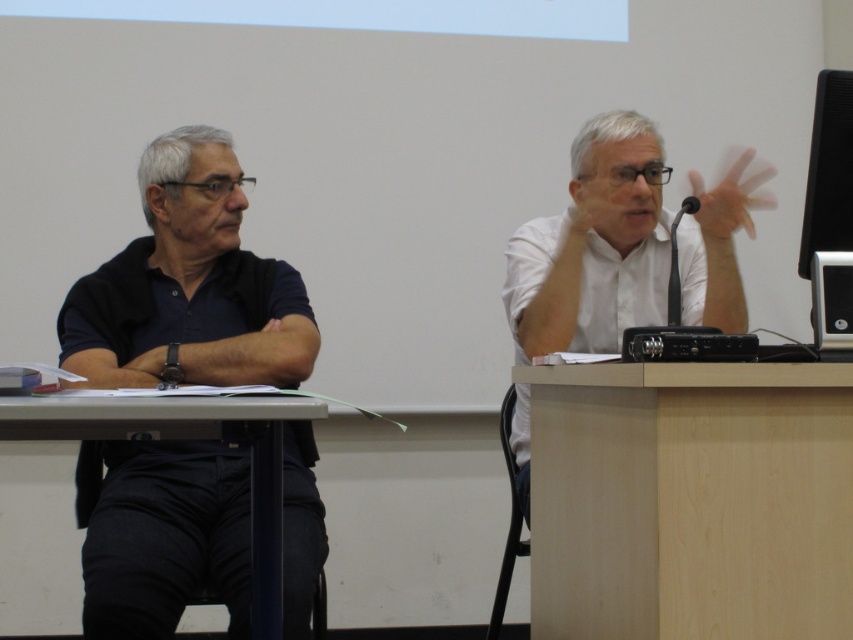
Who is positioned more to the left, white matte hand at upper right or black plastic projector at center?

black plastic projector at center is more to the left.

Does point (740, 209) lie in front of point (647, 360)?

That is False.

Who is more forward, [764,205] or [683,339]?

Point [683,339] is in front.

Where is `white matte hand at upper right`? white matte hand at upper right is located at coordinates (730, 196).

Between light brown wood table at right and black plastic projector at center, which one is positioned lower?

light brown wood table at right is lower down.

Between point (676, 582) and point (741, 336), which one is positioned behind?

Point (741, 336)

I want to click on light brown wood table at right, so click(x=689, y=500).

This screenshot has height=640, width=853. I want to click on light brown wood table at right, so click(689, 500).

Does white glossy shirt at upper right have a larger size compared to black glossy monitor at upper right?

Correct, white glossy shirt at upper right is larger in size than black glossy monitor at upper right.

What are the coordinates of `white glossy shirt at upper right` in the screenshot? It's located at point(595,246).

Where is `white glossy shirt at upper right`? This screenshot has height=640, width=853. white glossy shirt at upper right is located at coordinates (595, 246).